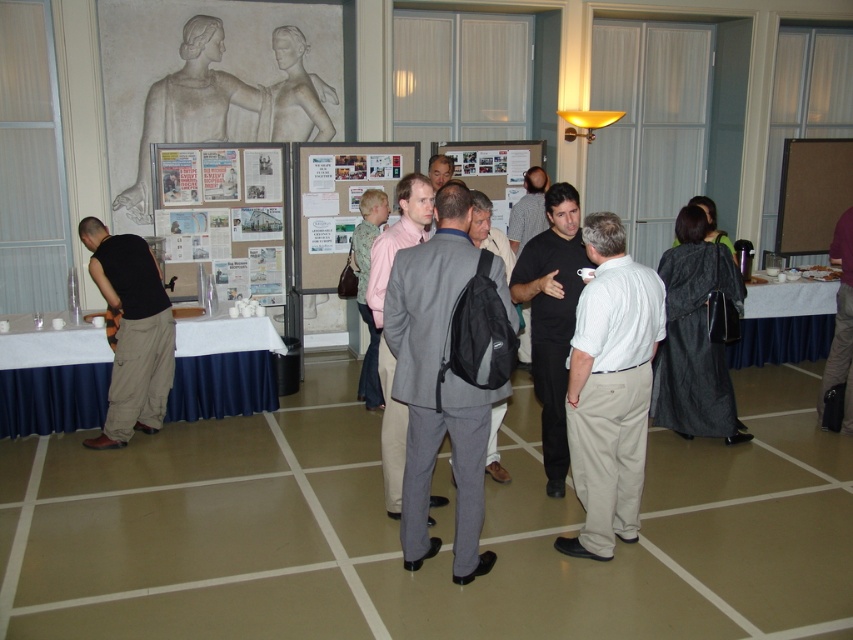
Question: Among these points, which one is nearest to the camera?

Choices:
 (A) (270, 212)
 (B) (395, 480)
 (C) (440, 172)
 (D) (520, 269)

Answer: (B)

Question: Considering the relative positions of white cotton shirt at center and gray suit at center in the image provided, where is white cotton shirt at center located with respect to gray suit at center?

Choices:
 (A) left
 (B) right

Answer: (B)

Question: Can you confirm if white paper poster at center is bigger than black cotton pants at left?

Choices:
 (A) no
 (B) yes

Answer: (B)

Question: Can you confirm if black cotton pants at left is thinner than purple sweater at center?

Choices:
 (A) yes
 (B) no

Answer: (B)

Question: Which point is closer to the camera taking this photo?

Choices:
 (A) (91, 230)
 (B) (846, 266)
 (C) (173, 225)
 (D) (531, 180)

Answer: (A)

Question: Which of the following is the farthest from the observer?

Choices:
 (A) matte gray suit at center
 (B) black fabric jacket at center
 (C) gray fabric backpack at center

Answer: (B)